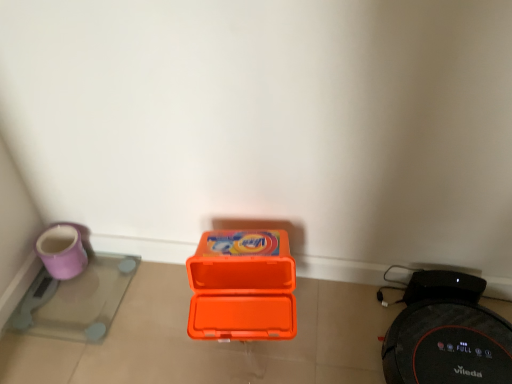
Locate an element on the screen. The height and width of the screenshot is (384, 512). vacant area that is in front of purple glossy scale at lower left, the first appliance viewed from the left is located at coordinates (74, 360).